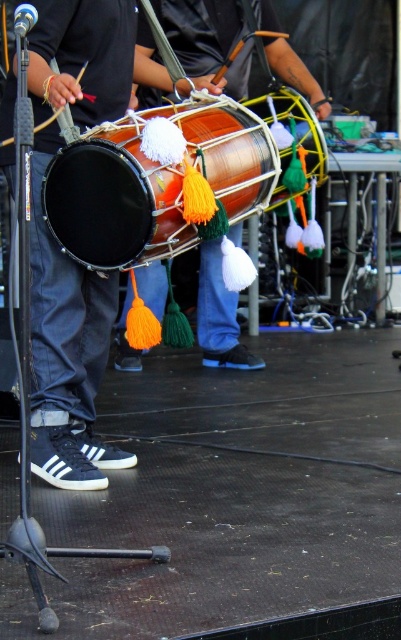
Question: Considering the real-world distances, which object is farthest from the shiny copper drum at center?

Choices:
 (A) matte black drum at left
 (B) matte copper drum at center
 (C) matte orange drum at center

Answer: (A)

Question: From the image, what is the correct spatial relationship of matte black drum at left in relation to matte copper drum at center?

Choices:
 (A) left
 (B) right

Answer: (A)

Question: Which point is farther to the camera?

Choices:
 (A) (210, 138)
 (B) (54, 416)

Answer: (B)

Question: Can you confirm if matte black drum at left is wider than matte copper drum at center?

Choices:
 (A) no
 (B) yes

Answer: (A)

Question: Is matte black drum at left thinner than matte orange drum at center?

Choices:
 (A) yes
 (B) no

Answer: (A)

Question: Which point is farther from the camera taking this photo?

Choices:
 (A) (299, 93)
 (B) (151, 42)
 (C) (107, 464)

Answer: (A)